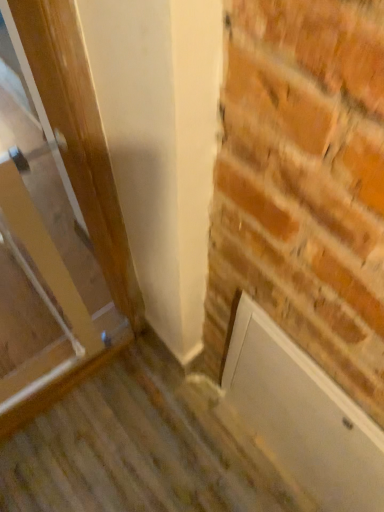
Find the location of `wooden door at left`. wooden door at left is located at coordinates (59, 229).

Describe the element at coordinates (59, 229) in the screenshot. This screenshot has width=384, height=512. I see `wooden door at left` at that location.

What do you see at coordinates (302, 416) in the screenshot? The width and height of the screenshot is (384, 512). I see `white matte door at lower right` at bounding box center [302, 416].

Where is `white matte door at lower right`? This screenshot has height=512, width=384. white matte door at lower right is located at coordinates (302, 416).

In order to face white matte door at lower right, should I rotate leftwards or rightwards?

A 13.495 degree turn to the right will do.

Locate an element on the screen. The width and height of the screenshot is (384, 512). wooden door at left is located at coordinates (59, 229).

Does white matte door at lower right appear on the right side of wooden door at left?

Indeed, white matte door at lower right is positioned on the right side of wooden door at left.

Which is behind, white matte door at lower right or wooden door at left?

white matte door at lower right is further from the camera.

Is point (338, 477) positioned before point (24, 36)?

No, it is behind (24, 36).

From the image's perspective, relative to wooden door at left, is white matte door at lower right above or below?

white matte door at lower right is below wooden door at left.

From a real-world perspective, who is located higher, white matte door at lower right or wooden door at left?

In real-world perspective, wooden door at left is above.

In terms of width, does white matte door at lower right look wider or thinner when compared to wooden door at left?

Considering their sizes, white matte door at lower right looks slimmer than wooden door at left.

Is white matte door at lower right taller than wooden door at left?

Incorrect, the height of white matte door at lower right is not larger of that of wooden door at left.

Can you confirm if white matte door at lower right is smaller than wooden door at left?

Correct, white matte door at lower right occupies less space than wooden door at left.

Can wooden door at left be found inside white matte door at lower right?

No, wooden door at left is not a part of white matte door at lower right.

Does white matte door at lower right touch wooden door at left?

white matte door at lower right and wooden door at left are not in contact.

Is white matte door at lower right turned away from wooden door at left?

white matte door at lower right is not turned away from wooden door at left.

How many degrees apart are the facing directions of white matte door at lower right and wooden door at left?

They differ by 90.9 degrees in their facing directions.

Locate an element on the screen. door on the left of the white matte door at lower right is located at coordinates (59, 229).

Is wooden door at left to the right of white matte door at lower right from the viewer's perspective?

Incorrect, wooden door at left is not on the right side of white matte door at lower right.

Is wooden door at left in front of white matte door at lower right?

Yes, it is in front of white matte door at lower right.

Is point (69, 130) closer to camera compared to point (326, 403)?

That is True.

From the image's perspective, is wooden door at left beneath white matte door at lower right?

No.

From a real-world perspective, is wooden door at left positioned under white matte door at lower right based on gravity?

No.

Based on the photo, considering the relative sizes of wooden door at left and white matte door at lower right in the image provided, is wooden door at left wider than white matte door at lower right?

Yes, wooden door at left is wider than white matte door at lower right.

In terms of height, does wooden door at left look taller or shorter compared to white matte door at lower right?

wooden door at left is taller than white matte door at lower right.

Who is bigger, wooden door at left or white matte door at lower right?

With larger size is wooden door at left.

Is white matte door at lower right inside wooden door at left?

No, white matte door at lower right is located outside of wooden door at left.

Is wooden door at left positioned far away from white matte door at lower right?

Actually, wooden door at left and white matte door at lower right are a little close together.

Does wooden door at left turn towards white matte door at lower right?

No, wooden door at left is not turned towards white matte door at lower right.

How different are the orientations of wooden door at left and white matte door at lower right in degrees?

The angular difference between wooden door at left and white matte door at lower right is 90.9 degrees.

In the image, there is a white matte door at lower right. In order to click on door above it (from the image's perspective) in this screenshot , I will do `click(59, 229)`.

Find the location of `door above the white matte door at lower right (from the image's perspective)`. door above the white matte door at lower right (from the image's perspective) is located at coordinates (59, 229).

Locate an element on the screen. Image resolution: width=384 pixels, height=512 pixels. screen door that is on the right side of wooden door at left is located at coordinates (302, 416).